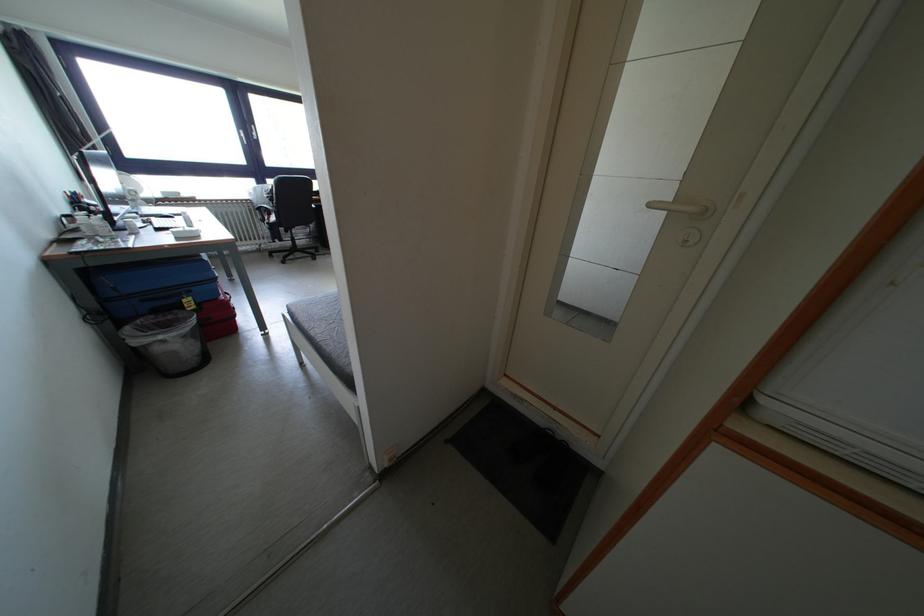
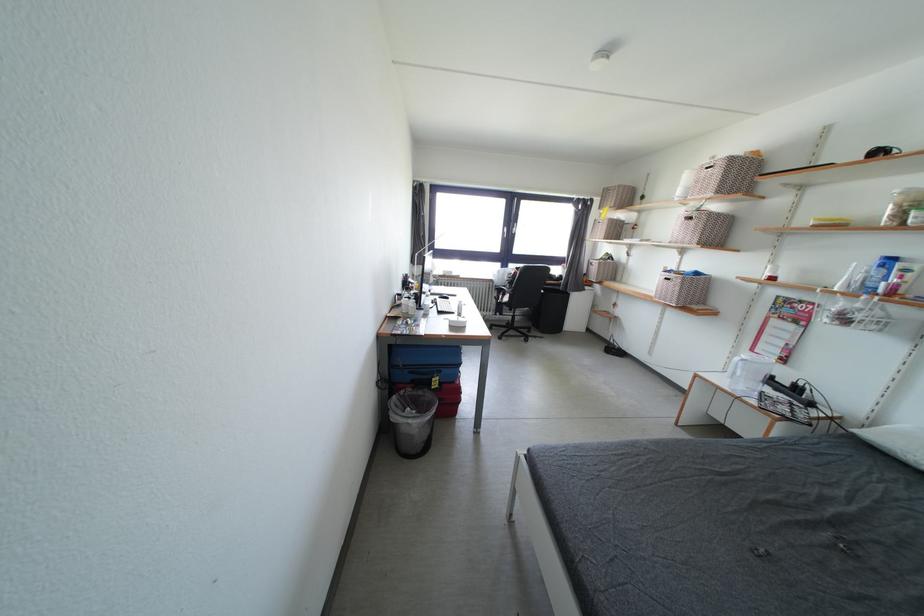
The point at (190, 305) is marked in the first image. Where is the corresponding point in the second image?

(440, 384)